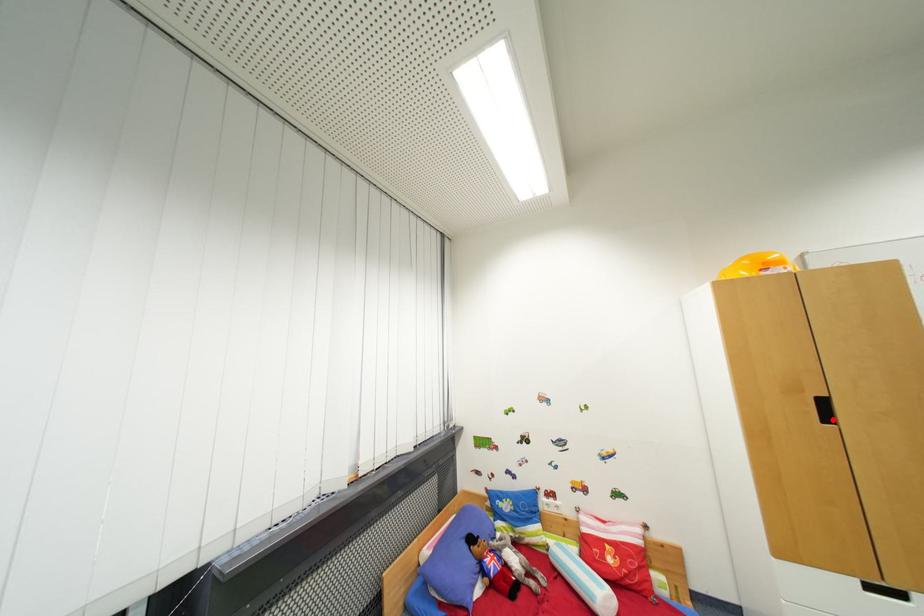
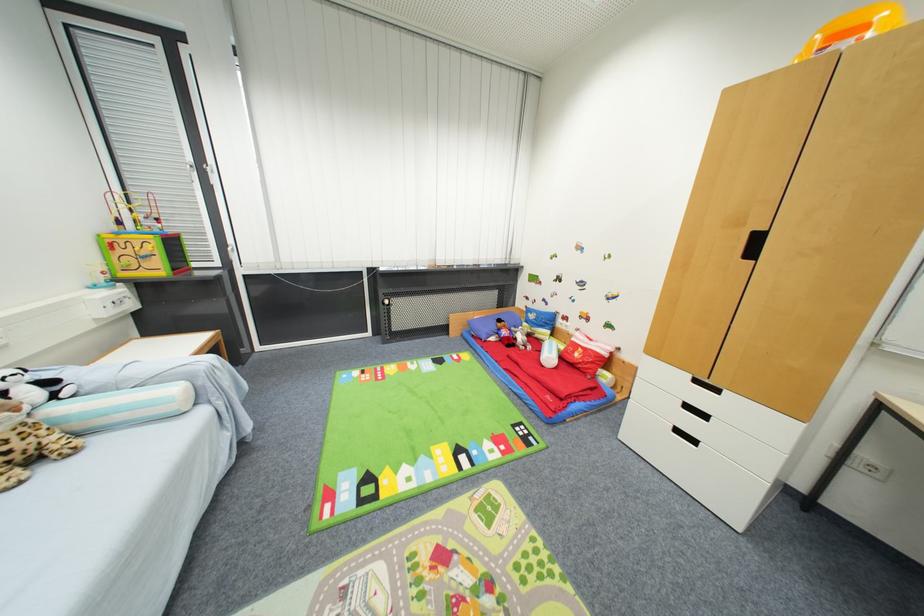
Question: I am providing you with two images of the same scene from different viewpoints. Given a red point in image1, look at the same physical point in image2. Is it:

Choices:
 (A) Closer to the viewpoint
 (B) Farther from the viewpoint

Answer: (B)